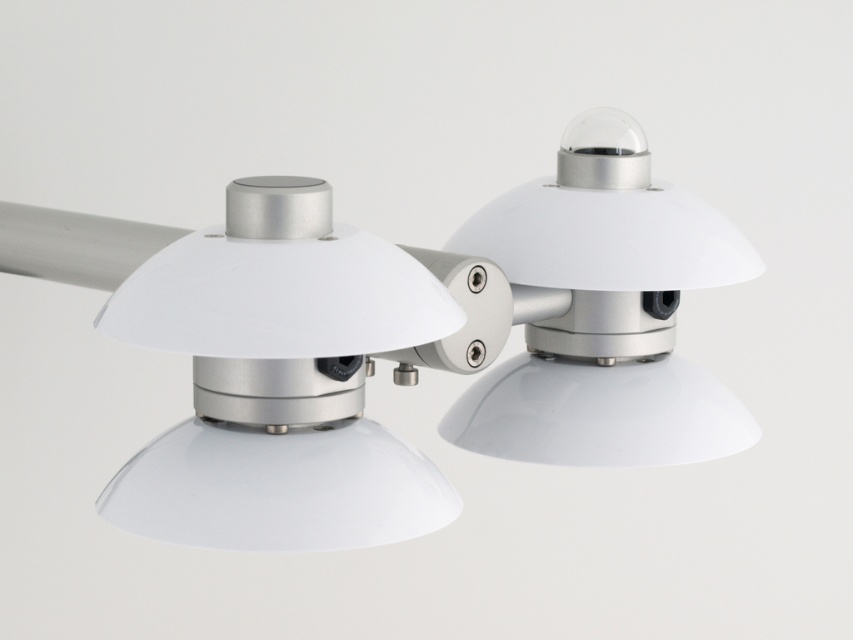
You are an interior designer arranging a modern living room. You have two light fixtures in front of you. One is the white matte lampshade at center and the other is the white glossy dome at upper right. According to the scene, which light fixture is located to the right of the other?

The white glossy dome at upper right is located to the right of the white matte lampshade at center.

You are an interior designer assessing the lighting setup in a room. You notice the white matte lampshade at center and the white glossy dome at upper right. Which of these fixtures has a lower height?

The white matte lampshade at center is shorter than the white glossy dome at upper right, so the white matte lampshade at center has a lower height.